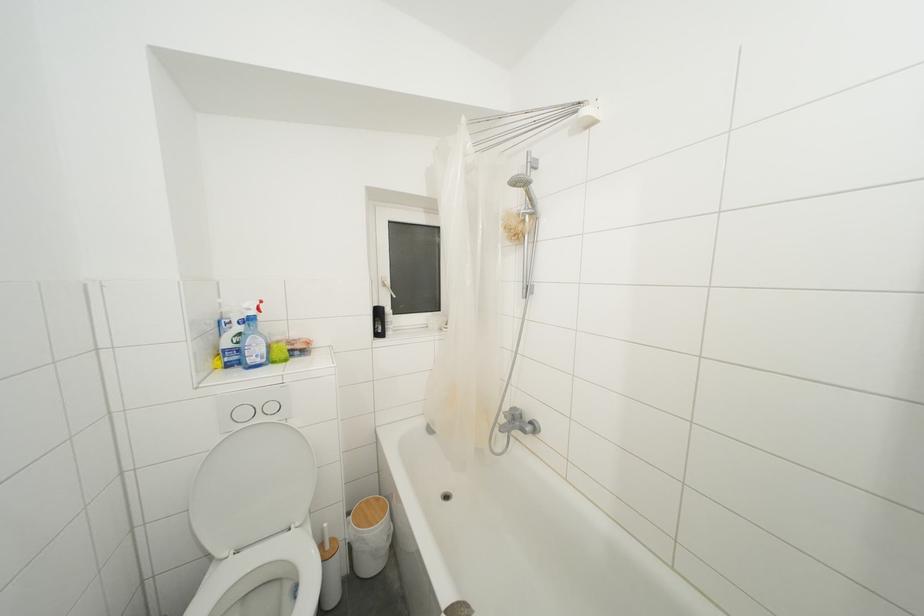
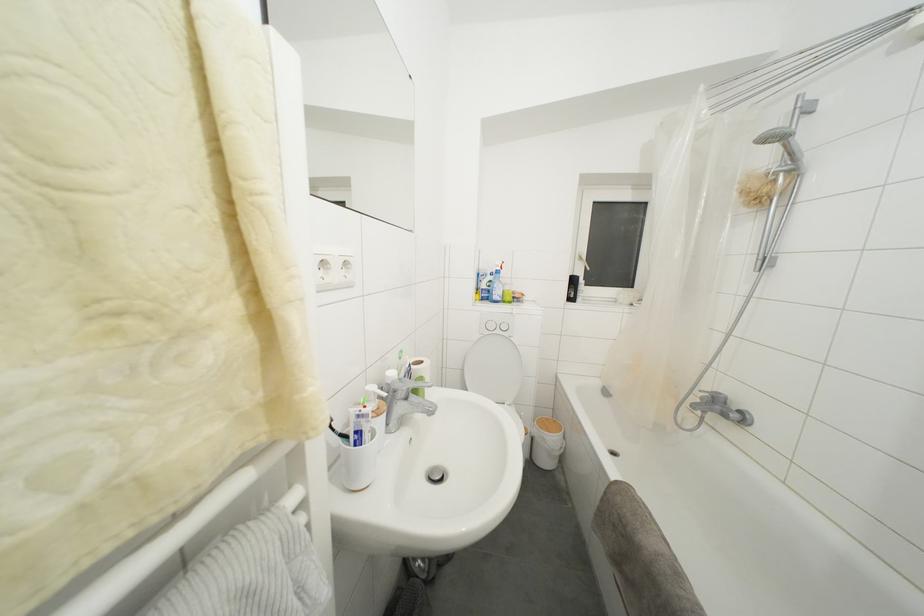
In the second image, find the point that corresponds to the point at 371,506 in the first image.

(552, 424)